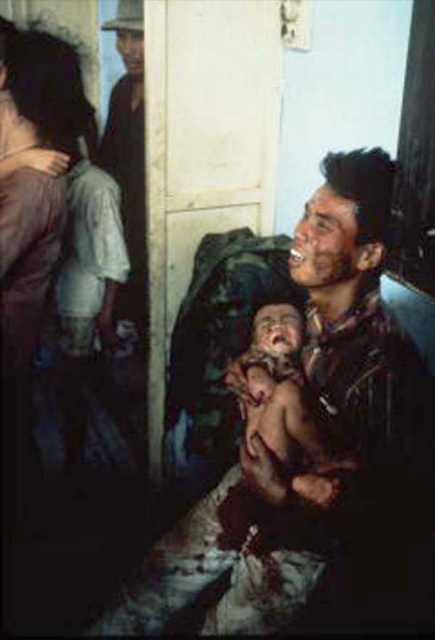
Does dirty brown shirt at center have a greater height compared to matte purple shirt at left?

Incorrect, dirty brown shirt at center's height is not larger of matte purple shirt at left's.

Between point (240, 433) and point (80, 86), which one is positioned behind?

The point (80, 86) is more distant.

The image size is (435, 640). I want to click on dirty brown shirt at center, so [x=304, y=449].

Is matte purple shirt at left positioned behind skinny baby at center?

Yes, it is behind skinny baby at center.

Is matte purple shirt at left in front of skinny baby at center?

No.

Is point (82, 124) in front of point (277, 310)?

That is False.

The width and height of the screenshot is (435, 640). What are the coordinates of `matte purple shirt at left` in the screenshot? It's located at (56, 252).

Does point (281, 456) come closer to viewer compared to point (307, 422)?

No, it is not.

What do you see at coordinates (304, 449) in the screenshot?
I see `dirty brown shirt at center` at bounding box center [304, 449].

I want to click on dirty brown shirt at center, so click(304, 449).